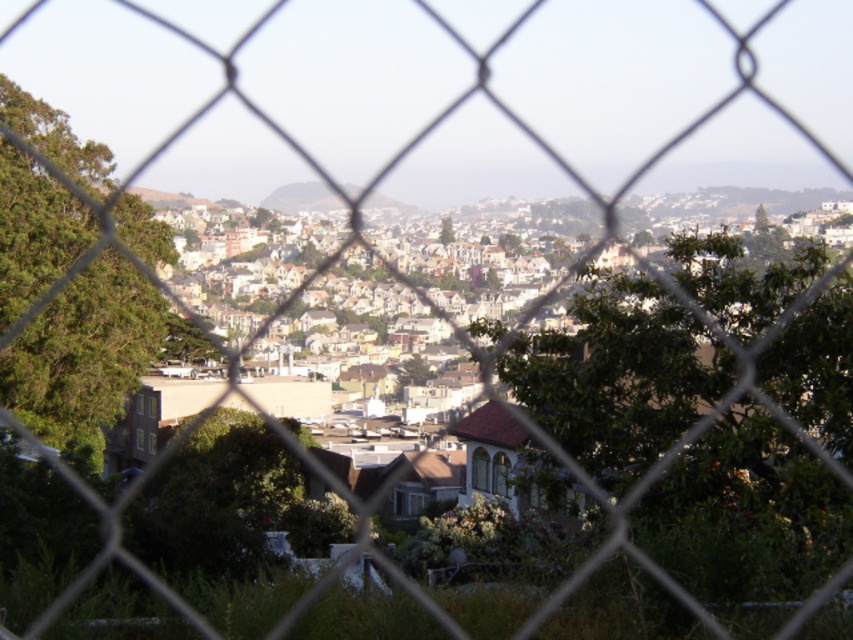
You are standing in front of a chain link fence and looking at the scene. There is a point marked at coordinates point (302, 196). What is located at that point?

The point (302, 196) indicates green grassy hillside at center.

You are standing in front of the chain link fence and see two green leafy trees. Which tree, the green leafy tree at center or the green leafy tree at left, is taller?

The green leafy tree at left is taller than the green leafy tree at center.

You are standing in front of the chain link fence and want to know which tree is taller between the green leafy tree at left and the green matte tree at center. Can you tell me?

The green leafy tree at left is taller than the green matte tree at center.